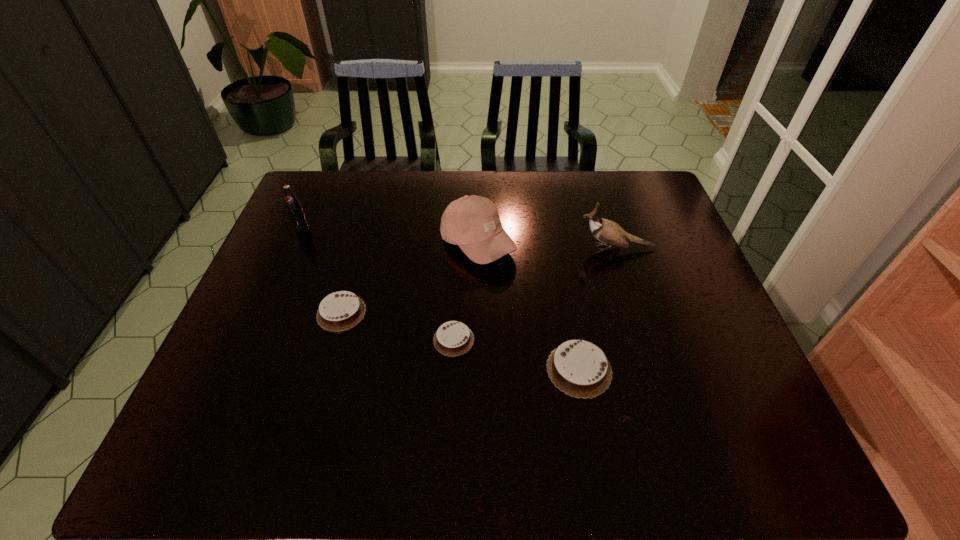
Please show where to add a chocolate cake on the right while keeping spacing even. Please provide its 2D coordinates. Your answer should be formatted as a tuple, i.e. [(x, y)], where the tuple contains the x and y coordinates of a point satisfying the conditions above.

[(720, 403)]